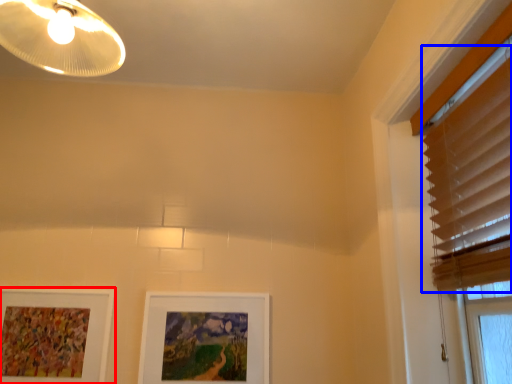
Question: Among these objects, which one is nearest to the camera, picture frame (highlighted by a red box) or blind (highlighted by a blue box)?

Choices:
 (A) picture frame
 (B) blind

Answer: (B)